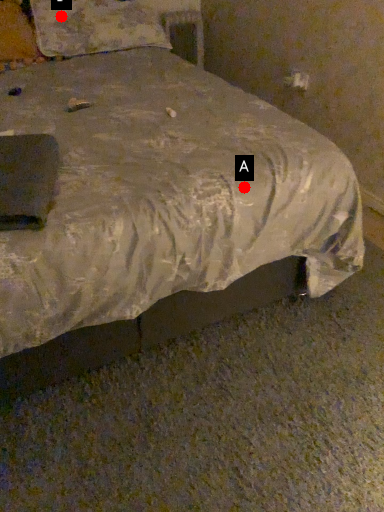
Question: Two points are circled on the image, labeled by A and B beside each circle. Which point is farther from the camera taking this photo?

Choices:
 (A) A is further
 (B) B is further

Answer: (B)